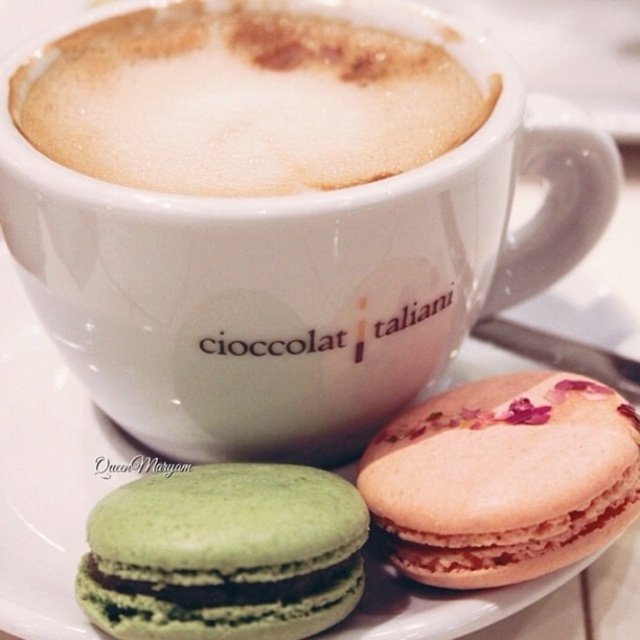
Question: Which point is closer to the camera?

Choices:
 (A) (417, 442)
 (B) (292, 611)

Answer: (B)

Question: Estimate the real-world distances between objects in this image. Which object is farther from the pink textured macaron at center?

Choices:
 (A) foamy white coffee at upper center
 (B) green matte macaron at lower left

Answer: (A)

Question: Considering the relative positions of pink textured macaron at center and green matte macaron at lower left in the image provided, where is pink textured macaron at center located with respect to green matte macaron at lower left?

Choices:
 (A) right
 (B) left

Answer: (A)

Question: Does pink textured macaron at center have a lesser width compared to green matte macaron at lower left?

Choices:
 (A) no
 (B) yes

Answer: (B)

Question: Which is farther from the foamy white coffee at upper center?

Choices:
 (A) green matte macaron at lower left
 (B) pink textured macaron at center

Answer: (A)

Question: Is foamy white coffee at upper center below pink textured macaron at center?

Choices:
 (A) no
 (B) yes

Answer: (A)